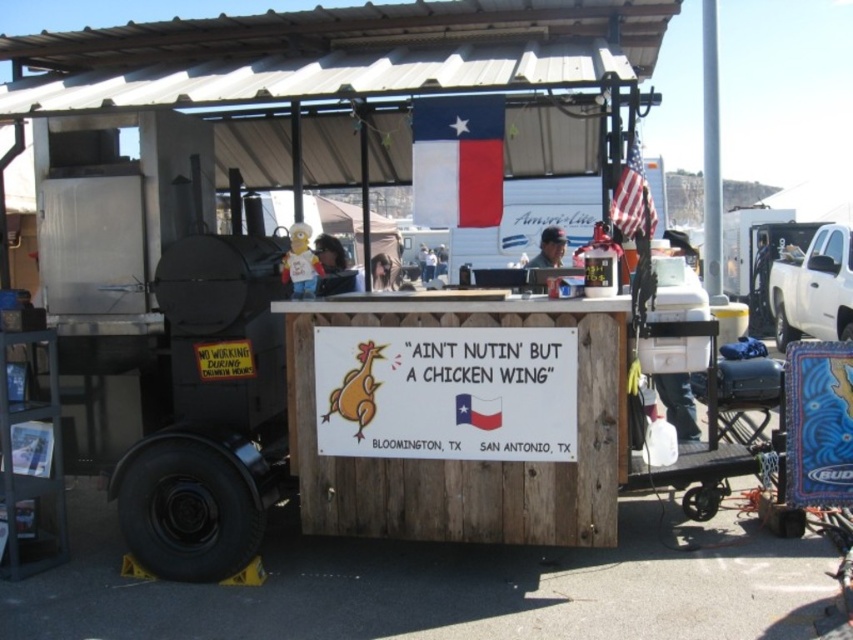
Between white wood sign at center and white plastic cooler at right, which one appears on the left side from the viewer's perspective?

From the viewer's perspective, white wood sign at center appears more on the left side.

Does white wood sign at center have a lesser width compared to white plastic cooler at right?

Correct, white wood sign at center's width is less than white plastic cooler at right's.

Where is `white wood sign at center`? white wood sign at center is located at coordinates (445, 392).

Image resolution: width=853 pixels, height=640 pixels. In order to click on white wood sign at center in this screenshot , I will do `click(445, 392)`.

The image size is (853, 640). What do you see at coordinates (811, 288) in the screenshot? I see `white plastic cooler at right` at bounding box center [811, 288].

Which is more to the right, white plastic cooler at right or american flag at upper right?

white plastic cooler at right is more to the right.

Does point (775, 291) lie behind point (630, 173)?

Yes, it is behind point (630, 173).

Find the location of a particular element. white plastic cooler at right is located at coordinates (811, 288).

Who is more forward, [828,262] or [552,259]?

Point [552,259] is more forward.

Is white plastic cooler at right above dark gray fabric cap at center?

Incorrect, white plastic cooler at right is not positioned above dark gray fabric cap at center.

Is point (792, 336) positioned before point (563, 240)?

No.

Where is `white plastic cooler at right`? This screenshot has width=853, height=640. white plastic cooler at right is located at coordinates (811, 288).